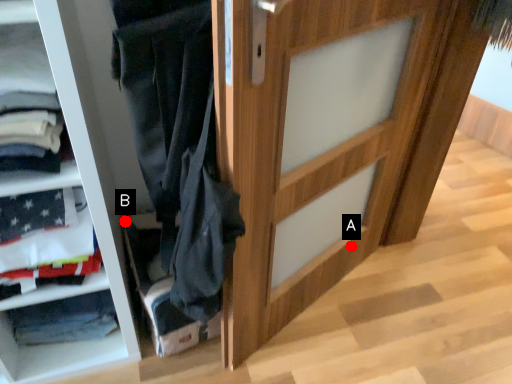
Question: Two points are circled on the image, labeled by A and B beside each circle. Which point appears closest to the camera in this image?

Choices:
 (A) A is closer
 (B) B is closer

Answer: (B)